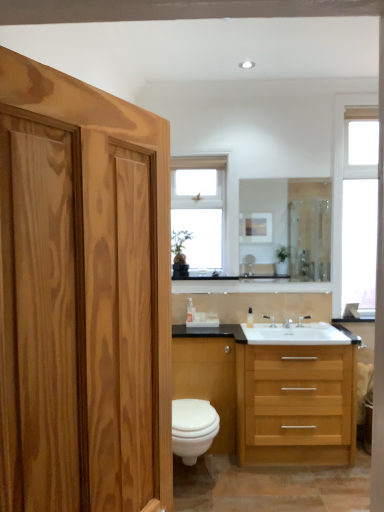
Question: Considering the positions of point (235, 372) and point (248, 316), is point (235, 372) closer or farther from the camera than point (248, 316)?

Choices:
 (A) closer
 (B) farther

Answer: (A)

Question: From their relative heights in the image, would you say white glossy cabinet at lower center is taller or shorter than white plastic soap dispenser at center?

Choices:
 (A) short
 (B) tall

Answer: (B)

Question: Estimate the real-world distances between objects in this image. Which object is farther from the silver metallic faucet at sink right, which appears as the first faucet when viewed from the right?

Choices:
 (A) white glossy toilet at lower center
 (B) clear glass mirror at center
 (C) clear glass window at upper center, acting as the 2th window starting from the right
 (D) silver metallic faucet at sink right, positioned as the second faucet in right-to-left order
 (E) white glossy cabinet at lower center

Answer: (C)

Question: Estimate the real-world distances between objects in this image. Which object is farther from the light wood/finish sink at lower right?

Choices:
 (A) white glossy cabinet at lower center
 (B) white glass window at upper right, which appears as the 2th window when viewed from the left
 (C) clear glass window at upper center, the 1th window in the left-to-right sequence
 (D) white plastic soap dispenser at center
 (E) clear glass mirror at center

Answer: (E)